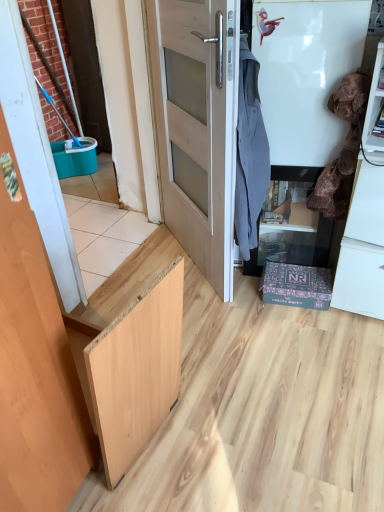
Question: From the image's perspective, is light wood door at center, the 1th door viewed from the right, on wooden door at left, acting as the 1th door starting from the front?

Choices:
 (A) no
 (B) yes

Answer: (B)

Question: Considering the relative sizes of light wood door at center, the first door viewed from the back, and wooden door at left, the 2th door from the back, in the image provided, is light wood door at center, the first door viewed from the back, thinner than wooden door at left, the 2th door from the back,?

Choices:
 (A) no
 (B) yes

Answer: (A)

Question: From a real-world perspective, is light wood door at center, the first door viewed from the back, under wooden door at left, the 2th door from the back?

Choices:
 (A) yes
 (B) no

Answer: (A)

Question: Would you say light wood door at center, which appears as the second door when viewed from the front, is outside wooden door at left, acting as the 1th door starting from the front?

Choices:
 (A) yes
 (B) no

Answer: (A)

Question: In terms of size, does light wood door at center, the first door viewed from the back, appear bigger or smaller than gray fabric shirt at upper right, acting as the 1th laundry starting from the left?

Choices:
 (A) small
 (B) big

Answer: (B)

Question: Is point (x=158, y=24) positioned closer to the camera than point (x=240, y=197)?

Choices:
 (A) closer
 (B) farther

Answer: (B)

Question: From the image's perspective, is light wood door at center, the 1th door viewed from the right, above or below gray fabric shirt at upper right, acting as the 1th laundry starting from the left?

Choices:
 (A) above
 (B) below

Answer: (A)

Question: Is light wood door at center, the 1th door viewed from the right, in front of or behind gray fabric shirt at upper right, the second laundry in the right-to-left sequence, in the image?

Choices:
 (A) front
 (B) behind

Answer: (A)

Question: From their relative heights in the image, would you say wooden door at left, acting as the 1th door starting from the front, is taller or shorter than velvet brown laundry at right, marked as the 2th laundry in a left-to-right arrangement?

Choices:
 (A) short
 (B) tall

Answer: (B)

Question: Relative to velvet brown laundry at right, marked as the 2th laundry in a left-to-right arrangement, is wooden door at left, the second door positioned from the right, in front or behind?

Choices:
 (A) behind
 (B) front

Answer: (B)

Question: Would you say wooden door at left, which is counted as the first door, starting from the left, is to the left or to the right of velvet brown laundry at right, marked as the 2th laundry in a left-to-right arrangement, in the picture?

Choices:
 (A) right
 (B) left

Answer: (B)

Question: Considering the positions of wooden door at left, the second door positioned from the right, and velvet brown laundry at right, acting as the first laundry starting from the right, in the image, is wooden door at left, the second door positioned from the right, bigger or smaller than velvet brown laundry at right, acting as the first laundry starting from the right,?

Choices:
 (A) big
 (B) small

Answer: (A)

Question: From a real-world perspective, is light wood door at center, which appears as the second door when viewed from the front, physically located above or below wooden door at left, the second door positioned from the right?

Choices:
 (A) above
 (B) below

Answer: (B)

Question: In terms of size, does light wood door at center, which appears as the second door when viewed from the front, appear bigger or smaller than wooden door at left, acting as the 1th door starting from the front?

Choices:
 (A) big
 (B) small

Answer: (A)